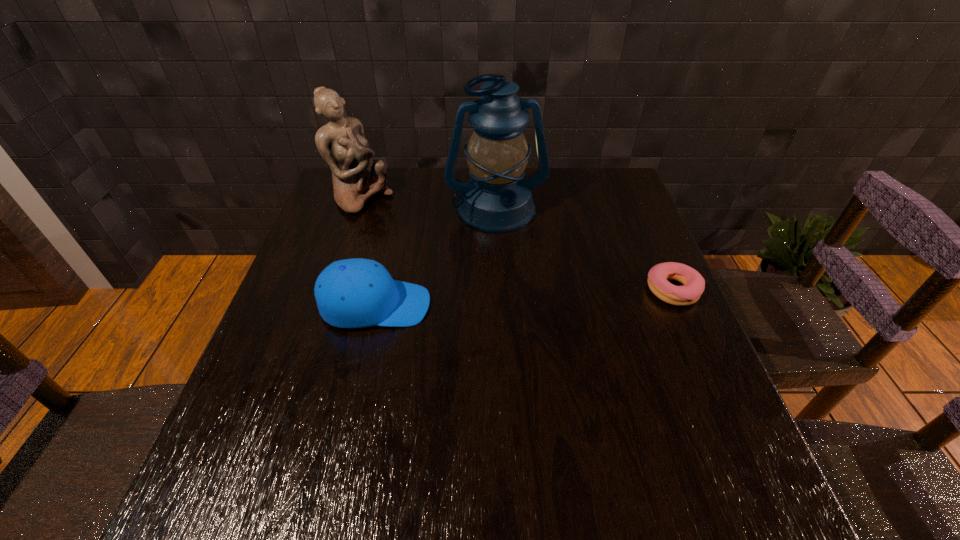
Identify the location of free space at the far edge of the desktop. The width and height of the screenshot is (960, 540). (428, 186).

The height and width of the screenshot is (540, 960). In the image, there is a desktop. In order to click on vacant space at the near edge in this screenshot , I will do `click(636, 406)`.

I want to click on free space at the left edge of the desktop, so click(x=322, y=243).

Image resolution: width=960 pixels, height=540 pixels. What are the coordinates of `vacant region at the right edge of the desktop` in the screenshot? It's located at (641, 357).

Where is `unoccupied area between the figurine and the cap`? The width and height of the screenshot is (960, 540). unoccupied area between the figurine and the cap is located at coordinates (369, 252).

Where is `free space between the rightmost object and the figurine`? free space between the rightmost object and the figurine is located at coordinates (517, 244).

The image size is (960, 540). Find the location of `free spot between the figurine and the rightmost object`. free spot between the figurine and the rightmost object is located at coordinates pyautogui.click(x=517, y=244).

Locate an element on the screen. vacant space that's between the cap and the tallest object is located at coordinates (436, 257).

I want to click on empty location between the tallest object and the cap, so click(x=436, y=257).

The image size is (960, 540). I want to click on unoccupied position between the cap and the lantern, so click(x=436, y=257).